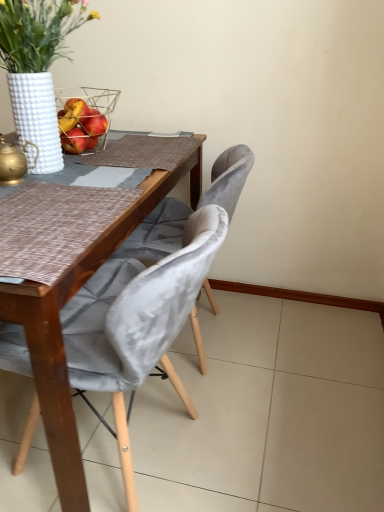
Question: Considering the relative sizes of velvet grey chair at center, the 2th chair positioned from the front, and white textured vase at upper left in the image provided, is velvet grey chair at center, the 2th chair positioned from the front, bigger than white textured vase at upper left?

Choices:
 (A) yes
 (B) no

Answer: (A)

Question: Is white textured vase at upper left completely or partially inside velvet grey chair at center, the 2th chair positioned from the front?

Choices:
 (A) no
 (B) yes

Answer: (A)

Question: Is velvet grey chair at center, acting as the 1th chair starting from the back, facing away from white textured vase at upper left?

Choices:
 (A) no
 (B) yes

Answer: (A)

Question: Is velvet grey chair at center, acting as the 1th chair starting from the back, taller than white textured vase at upper left?

Choices:
 (A) no
 (B) yes

Answer: (B)

Question: Does velvet grey chair at center, the 2th chair positioned from the front, have a lesser width compared to white textured vase at upper left?

Choices:
 (A) no
 (B) yes

Answer: (A)

Question: Does point (142, 260) appear closer or farther from the camera than point (0, 179)?

Choices:
 (A) closer
 (B) farther

Answer: (B)

Question: From a real-world perspective, is velvet grey chair at center, the 2th chair positioned from the front, positioned above or below gold metallic teapot at left?

Choices:
 (A) below
 (B) above

Answer: (A)

Question: Considering the positions of velvet grey chair at center, acting as the 1th chair starting from the back, and gold metallic teapot at left in the image, is velvet grey chair at center, acting as the 1th chair starting from the back, taller or shorter than gold metallic teapot at left?

Choices:
 (A) short
 (B) tall

Answer: (B)

Question: Would you say velvet grey chair at center, acting as the 1th chair starting from the back, is to the left or to the right of gold metallic teapot at left in the picture?

Choices:
 (A) right
 (B) left

Answer: (A)

Question: From a real-world perspective, relative to velvet grey chair at center, acting as the first chair starting from the front, is metallic wire picnic basket at upper left vertically above or below?

Choices:
 (A) above
 (B) below

Answer: (A)

Question: From the image's perspective, is metallic wire picnic basket at upper left positioned above or below velvet grey chair at center, placed as the 2th chair when sorted from back to front?

Choices:
 (A) above
 (B) below

Answer: (A)

Question: Considering the positions of metallic wire picnic basket at upper left and velvet grey chair at center, acting as the first chair starting from the front, in the image, is metallic wire picnic basket at upper left wider or thinner than velvet grey chair at center, acting as the first chair starting from the front,?

Choices:
 (A) thin
 (B) wide

Answer: (A)

Question: Choose the correct answer: Is metallic wire picnic basket at upper left inside velvet grey chair at center, placed as the 2th chair when sorted from back to front, or outside it?

Choices:
 (A) outside
 (B) inside

Answer: (A)

Question: Choose the correct answer: Is white textured vase at upper left inside velvet grey chair at center, acting as the 1th chair starting from the back, or outside it?

Choices:
 (A) outside
 (B) inside

Answer: (A)

Question: Considering the positions of white textured vase at upper left and velvet grey chair at center, acting as the 1th chair starting from the back, in the image, is white textured vase at upper left bigger or smaller than velvet grey chair at center, acting as the 1th chair starting from the back,?

Choices:
 (A) big
 (B) small

Answer: (B)